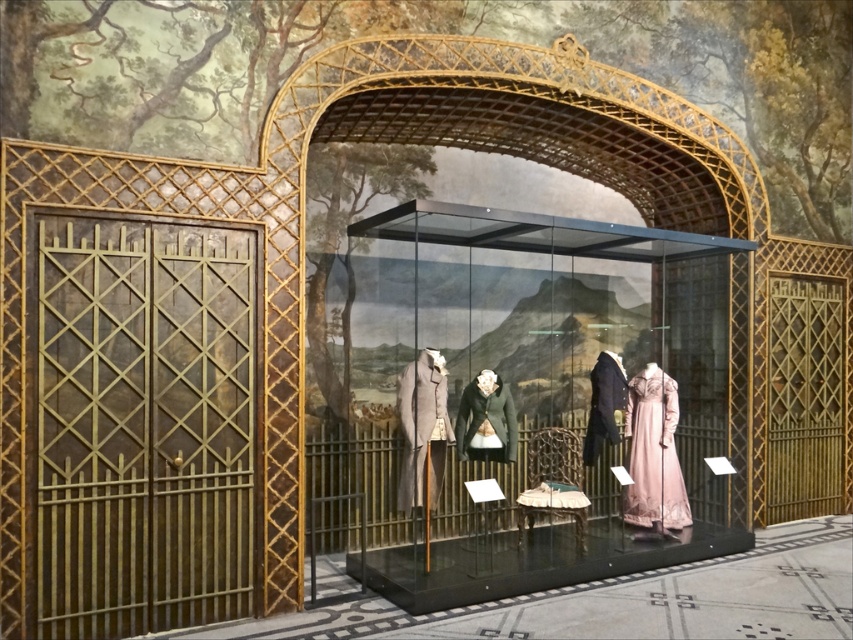
Between pink satin dress at center and light gray wool coat at center, which one is positioned higher?

Positioned higher is light gray wool coat at center.

Is pink satin dress at center to the right of light gray wool coat at center from the viewer's perspective?

Yes, pink satin dress at center is to the right of light gray wool coat at center.

In order to click on pink satin dress at center in this screenshot , I will do `click(653, 452)`.

Where is `pink satin dress at center`? This screenshot has width=853, height=640. pink satin dress at center is located at coordinates (653, 452).

Between point (65, 444) and point (415, 403), which one is positioned behind?

The point (415, 403) is behind.

Does gold textured gate at left have a lesser height compared to light gray wool coat at center?

Incorrect, gold textured gate at left's height does not fall short of light gray wool coat at center's.

Locate an element on the screen. Image resolution: width=853 pixels, height=640 pixels. gold textured gate at left is located at coordinates [143, 424].

I want to click on gold textured gate at left, so click(143, 424).

Who is positioned more to the right, gold textured gate at left or pink satin dress at center?

pink satin dress at center is more to the right.

The width and height of the screenshot is (853, 640). What are the coordinates of `gold textured gate at left` in the screenshot? It's located at (143, 424).

Image resolution: width=853 pixels, height=640 pixels. I want to click on gold textured gate at left, so click(143, 424).